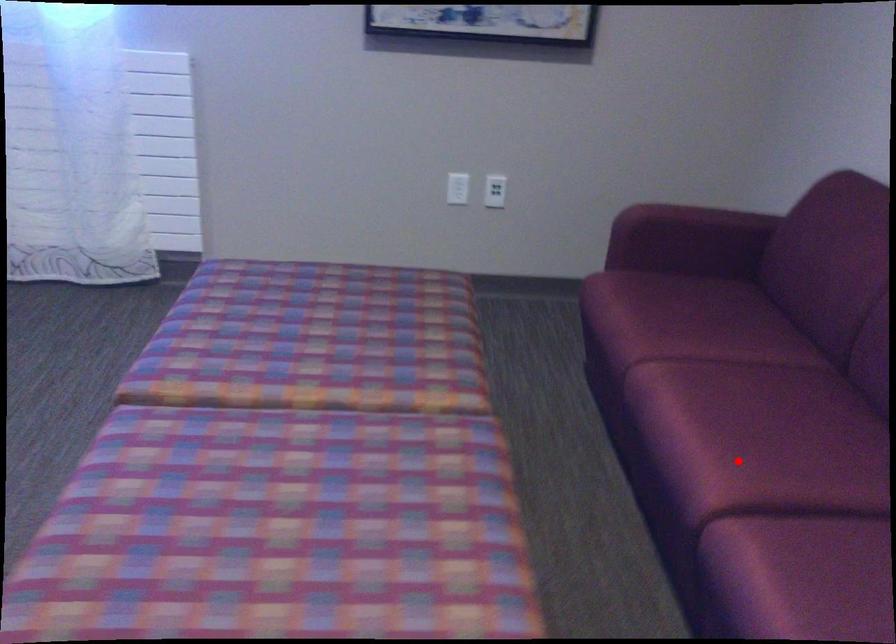
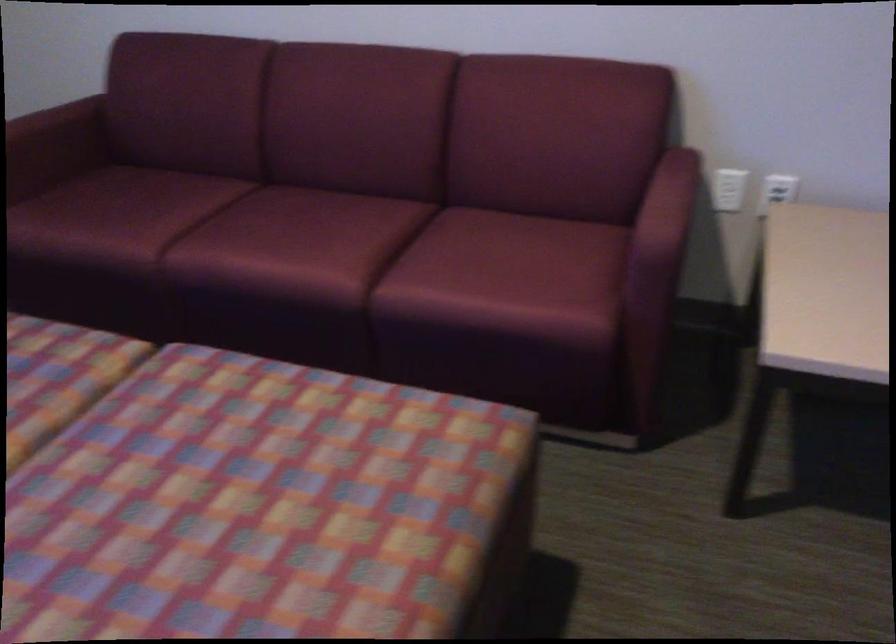
Where in the second image is the point corresponding to the highlighted location from the first image?

(332, 249)